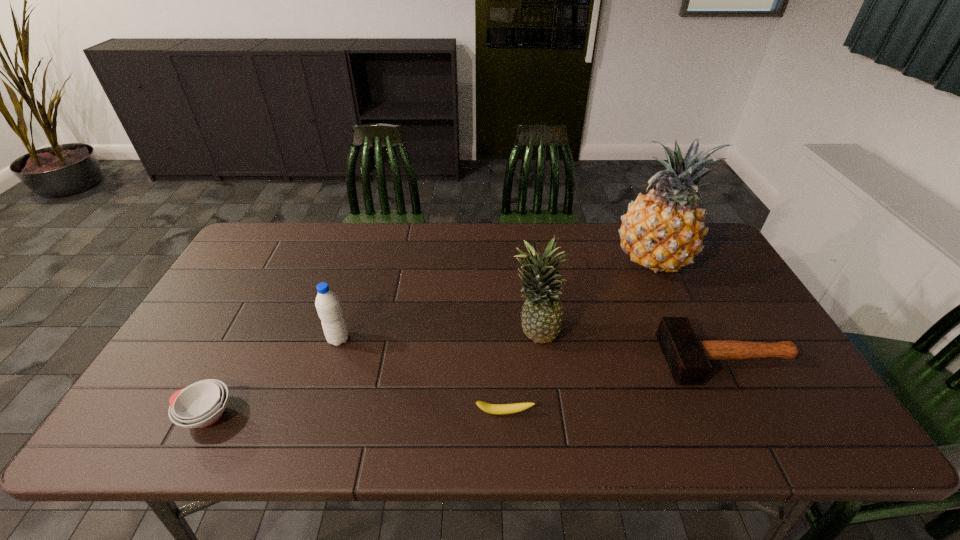
Where is `free spot at the far left corner of the desktop`? The width and height of the screenshot is (960, 540). free spot at the far left corner of the desktop is located at coordinates (258, 254).

Identify the location of free space that is in between the mallet and the shortest object. The height and width of the screenshot is (540, 960). (615, 386).

Find the location of a particular element. vacant space that's between the water bottle and the mallet is located at coordinates (533, 349).

The image size is (960, 540). What are the coordinates of `blank region between the left pineapple and the third tallest object` in the screenshot? It's located at (437, 336).

Find the location of `unoccupied position between the right pineapple and the third shortest object`. unoccupied position between the right pineapple and the third shortest object is located at coordinates (690, 310).

Identify the location of free spot between the soup bowl and the banana. (355, 414).

The height and width of the screenshot is (540, 960). In order to click on empty space between the leftmost object and the left pineapple in this screenshot , I will do `click(371, 373)`.

This screenshot has width=960, height=540. Find the location of `vacant space in between the banana and the farthest object`. vacant space in between the banana and the farthest object is located at coordinates click(578, 336).

The image size is (960, 540). Find the location of `empty space that is in between the tallest object and the third shortest object`. empty space that is in between the tallest object and the third shortest object is located at coordinates (690, 310).

The image size is (960, 540). I want to click on unoccupied area between the fourth shortest object and the soup bowl, so click(273, 377).